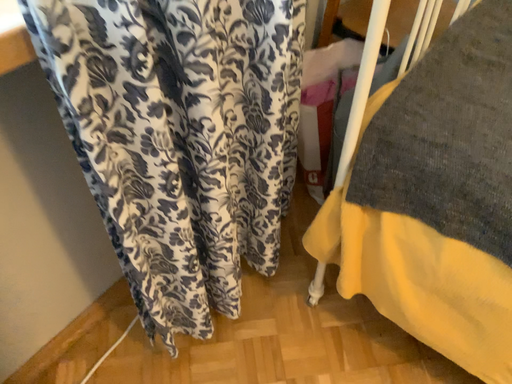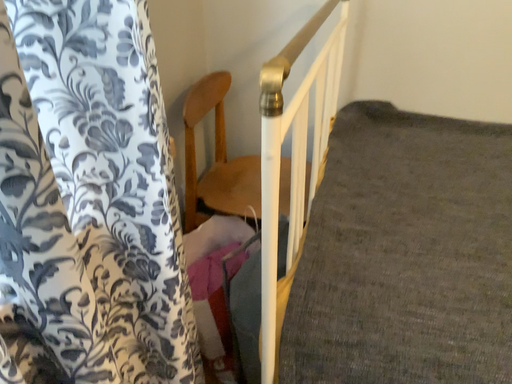
Question: How did the camera likely rotate when shooting the video?

Choices:
 (A) rotated upward
 (B) rotated downward

Answer: (A)